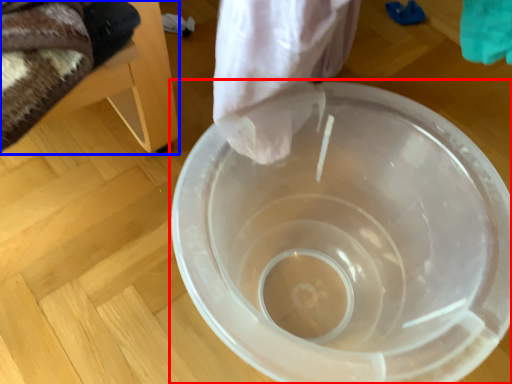
Question: Which point is closer to the camera, toilet (highlighted by a red box) or furniture (highlighted by a blue box)?

Choices:
 (A) toilet
 (B) furniture

Answer: (B)